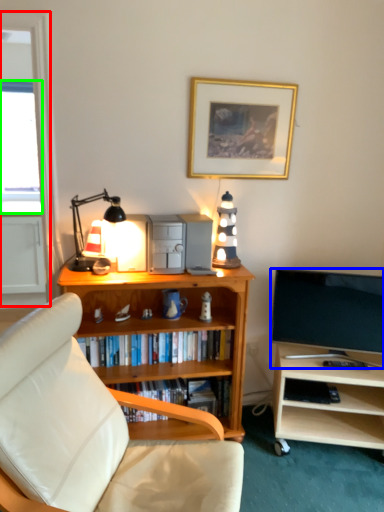
Question: Based on their relative distances, which object is nearer to glass door (highlighted by a red box)? Choose from television (highlighted by a blue box) and window screen (highlighted by a green box).

Choices:
 (A) television
 (B) window screen

Answer: (A)